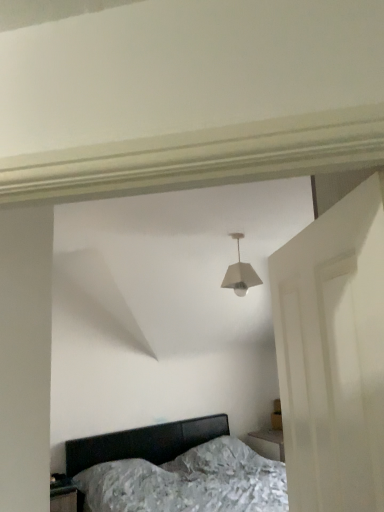
Question: Would you say matte black bed at lower center is inside or outside white matte lampshade at center?

Choices:
 (A) outside
 (B) inside

Answer: (A)

Question: From the image's perspective, is matte black bed at lower center positioned above or below white matte lampshade at center?

Choices:
 (A) above
 (B) below

Answer: (B)

Question: Which of these objects is positioned closest to the white matte lampshade at center?

Choices:
 (A) matte black bed at lower center
 (B) white matte door at right

Answer: (B)

Question: Estimate the real-world distances between objects in this image. Which object is closer to the white matte door at right?

Choices:
 (A) matte black bed at lower center
 (B) white matte lampshade at center

Answer: (B)